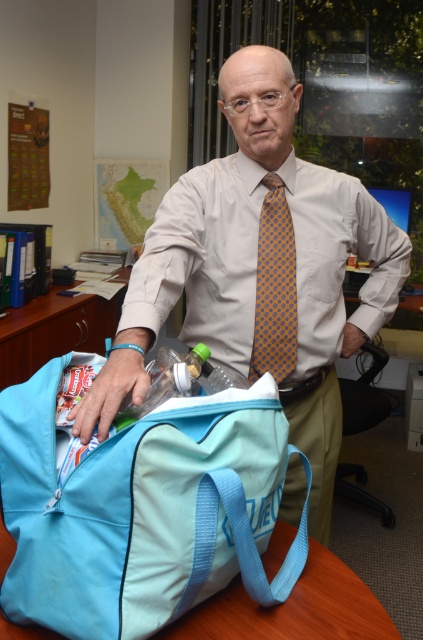
Which is in front, point (51, 467) or point (258, 621)?

Point (51, 467)

Is point (219, 481) positioned after point (282, 637)?

No, (219, 481) is closer to viewer.

Is point (8, 424) behind point (32, 637)?

That is True.

This screenshot has height=640, width=423. Identify the location of light blue fabric bag at center. (142, 508).

Which is behind, point (52, 406) or point (263, 257)?

Point (263, 257)

Between light blue fabric bag at center and yellow dotted tie at center, which one appears on the right side from the viewer's perspective?

yellow dotted tie at center is more to the right.

The width and height of the screenshot is (423, 640). Find the location of `light blue fabric bag at center`. light blue fabric bag at center is located at coordinates (142, 508).

Locate an element on the screen. light blue fabric bag at center is located at coordinates (142, 508).

Does beige cotton dress shirt at center have a greater width compared to light blue fabric bag at lower center?

Yes.

Is beige cotton dress shirt at center to the right of light blue fabric bag at lower center from the viewer's perspective?

Yes, beige cotton dress shirt at center is to the right of light blue fabric bag at lower center.

Where is `beige cotton dress shirt at center`? The width and height of the screenshot is (423, 640). beige cotton dress shirt at center is located at coordinates (203, 259).